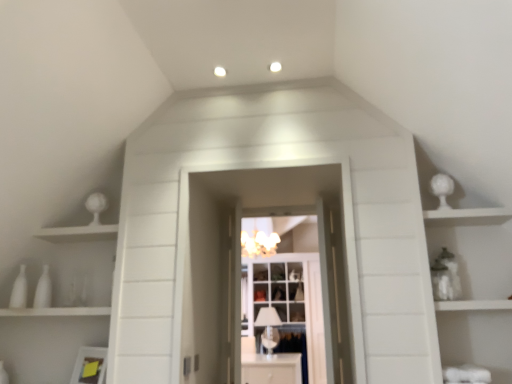
Question: From the image's perspective, is white glossy door at center positioned above or below clear glass cabinet at center?

Choices:
 (A) below
 (B) above

Answer: (B)

Question: Does point (296, 160) appear closer or farther from the camera than point (294, 316)?

Choices:
 (A) closer
 (B) farther

Answer: (A)

Question: Estimate the real-world distances between objects in this image. Which object is closer to the white glass cupboard at center?

Choices:
 (A) white glossy cabinet at center
 (B) white glossy door at center
 (C) white glossy vases at left
 (D) clear glass cabinet at center
 (E) white frosted glass light fixture at center

Answer: (D)

Question: Considering the real-world distances, which object is farthest from the white frosted glass light fixture at center?

Choices:
 (A) white glossy sphere at upper right
 (B) white glossy door at center
 (C) white glossy vases at left
 (D) clear glass cabinet at center
 (E) white glass cupboard at center

Answer: (A)